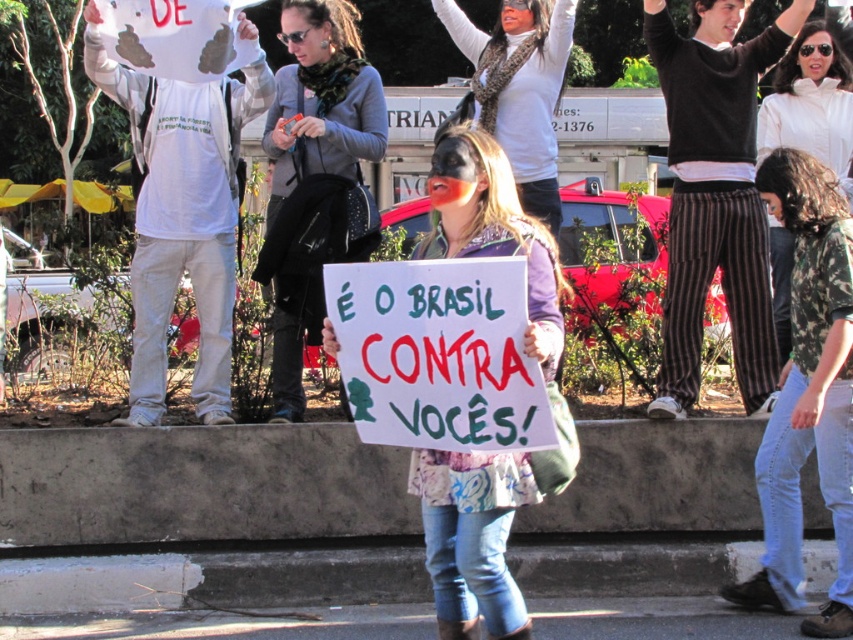
Which is above, white paper sign at center or matte black mask at center?

matte black mask at center

Which of these two, white paper sign at center or matte black mask at center, stands shorter?

Standing shorter between the two is white paper sign at center.

Find the location of a particular element. This screenshot has height=640, width=853. white paper sign at center is located at coordinates (473, 538).

Is dark brown striped pants at center to the right of white paper sign at center from the viewer's perspective?

Yes, dark brown striped pants at center is to the right of white paper sign at center.

Between point (730, 312) and point (526, 636), which one is positioned in front?

Point (526, 636)

Image resolution: width=853 pixels, height=640 pixels. I want to click on dark brown striped pants at center, so click(x=715, y=195).

Does point (216, 394) come in front of point (544, 131)?

Yes.

Measure the distance between point [113,65] and camera.

20.77 feet

What do you see at coordinates (181, 218) in the screenshot?
I see `white matte shirt at left` at bounding box center [181, 218].

The width and height of the screenshot is (853, 640). What are the coordinates of `white matte shirt at left` in the screenshot? It's located at (181, 218).